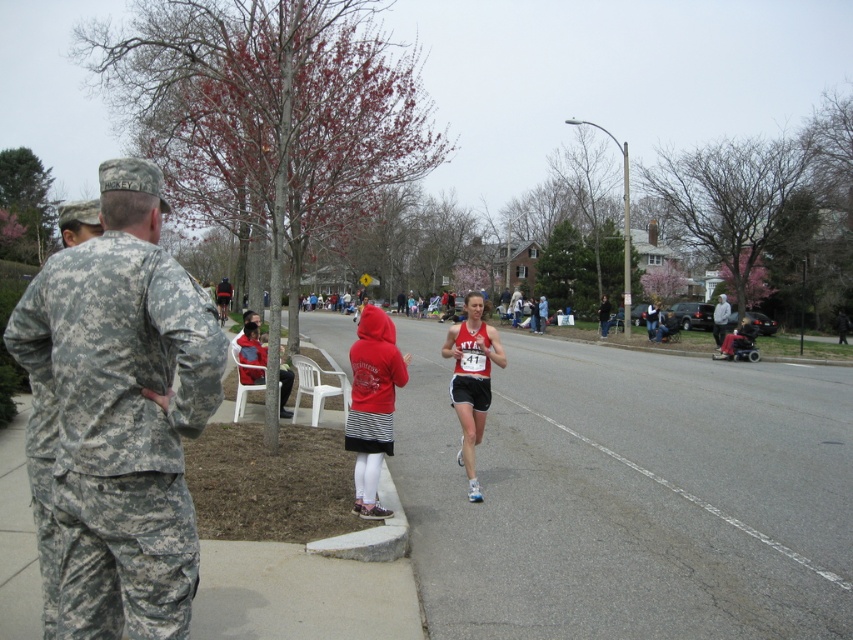
Between gray asphalt road at center and matte red running outfit at center, which one is positioned higher?

matte red running outfit at center

Who is lower down, gray asphalt road at center or matte red running outfit at center?

gray asphalt road at center

Is point (440, 529) farther from viewer compared to point (454, 408)?

No, (440, 529) is in front of (454, 408).

Where is `gray asphalt road at center`? gray asphalt road at center is located at coordinates (630, 496).

Is camouflage uniform at left to the right of gray hoodie at center from the viewer's perspective?

Incorrect, camouflage uniform at left is not on the right side of gray hoodie at center.

Between point (144, 264) and point (717, 324), which one is positioned in front?

Positioned in front is point (144, 264).

What are the coordinates of `camouflage uniform at left` in the screenshot? It's located at (122, 412).

Is gray asphalt road at center smaller than gray hoodie at center?

No, gray asphalt road at center is not smaller than gray hoodie at center.

Is gray asphalt road at center wider than gray hoodie at center?

Indeed, gray asphalt road at center has a greater width compared to gray hoodie at center.

You are a GUI agent. You are given a task and a screenshot of the screen. Output one action in this format:
    pyautogui.click(x=<x>, y=<y>)
    Task: Click on the gray asphalt road at center
    This screenshot has width=853, height=640.
    Given the screenshot: What is the action you would take?
    pyautogui.click(x=630, y=496)